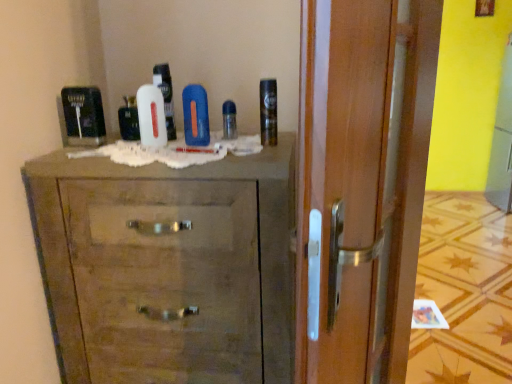
Question: Relative to shiny metallic can at upper right, marked as the first shaving cream in a right-to-left arrangement, is blue matte bottle at center in front or behind?

Choices:
 (A) front
 (B) behind

Answer: (B)

Question: In terms of height, does blue matte bottle at center look taller or shorter compared to shiny metallic can at upper right, marked as the first shaving cream in a right-to-left arrangement?

Choices:
 (A) short
 (B) tall

Answer: (A)

Question: Which of these objects is positioned farthest from the white matte shaving cream at center, the 2th shaving cream positioned from the right?

Choices:
 (A) blue matte bottle at center
 (B) blue glossy mouthwash at center, which is counted as the 1th mouthwash, starting from the right
 (C) wooden chest of drawers at center
 (D) shiny metallic can at upper right, positioned as the 3th shaving cream in left-to-right order
 (E) white glossy mouthwash at center, placed as the 1th mouthwash when sorted from left to right

Answer: (C)

Question: Estimate the real-world distances between objects in this image. Which object is farther from the blue glossy mouthwash at center, which is counted as the 1th mouthwash, starting from the right?

Choices:
 (A) white matte shaving cream at center, acting as the third shaving cream starting from the right
 (B) wooden chest of drawers at center
 (C) white matte shaving cream at center, the 2th shaving cream positioned from the right
 (D) yellow matte screen door at upper right
 (E) shiny metallic can at upper right, positioned as the 3th shaving cream in left-to-right order

Answer: (D)